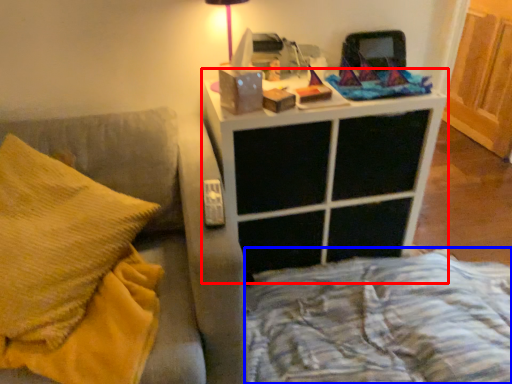
Question: Which of the following is the closest to the observer, nightstand (highlighted by a red box) or bed frame (highlighted by a blue box)?

Choices:
 (A) nightstand
 (B) bed frame

Answer: (B)